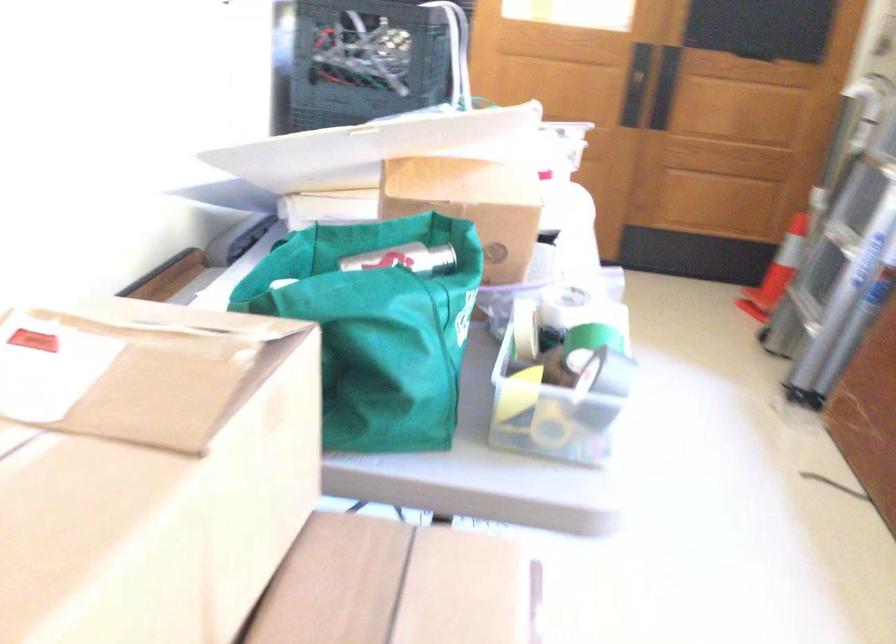
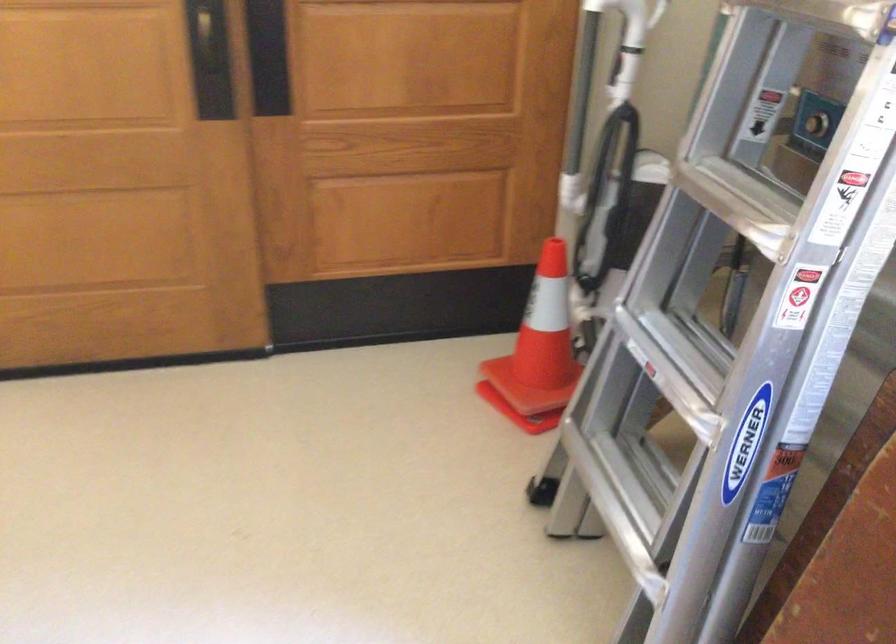
Where in the second image is the point corresponding to (x=807, y=261) from the first image?

(539, 343)